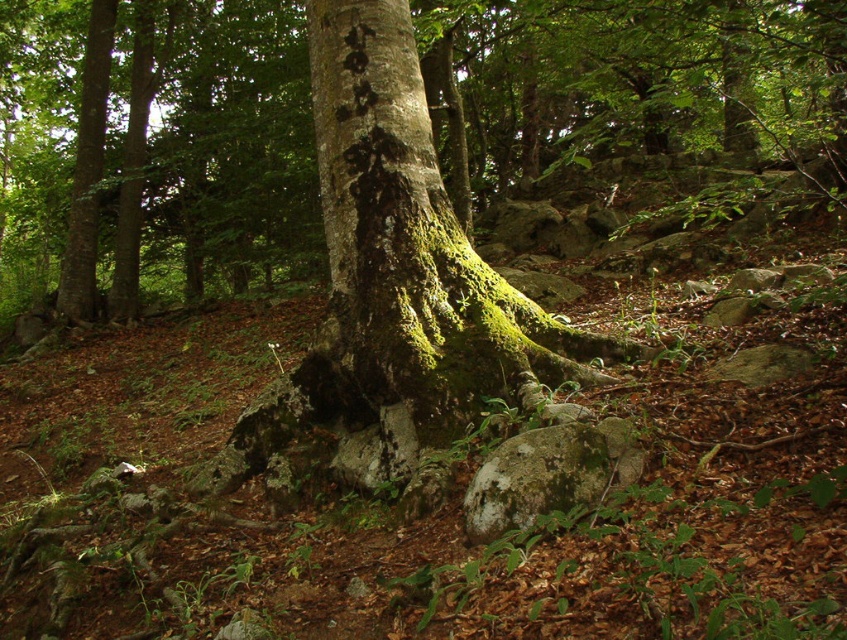
Question: Which of the following is the farthest from the observer?

Choices:
 (A) (197, 278)
 (B) (342, 234)
 (C) (565, 444)

Answer: (A)

Question: From the image, what is the correct spatial relationship of green mossy tree trunk at center in relation to green mossy rock at lower center?

Choices:
 (A) above
 (B) below

Answer: (A)

Question: Can you confirm if green mossy tree trunk at center is thinner than green mossy bark at center?

Choices:
 (A) yes
 (B) no

Answer: (B)

Question: Which is farther from the green mossy rock at lower center?

Choices:
 (A) green mossy bark at center
 (B) green mossy tree trunk at center

Answer: (B)

Question: Can you confirm if green mossy tree trunk at center is positioned above green mossy bark at center?

Choices:
 (A) yes
 (B) no

Answer: (A)

Question: Which point is farther from the camera taking this photo?

Choices:
 (A) (494, 528)
 (B) (119, 291)

Answer: (B)